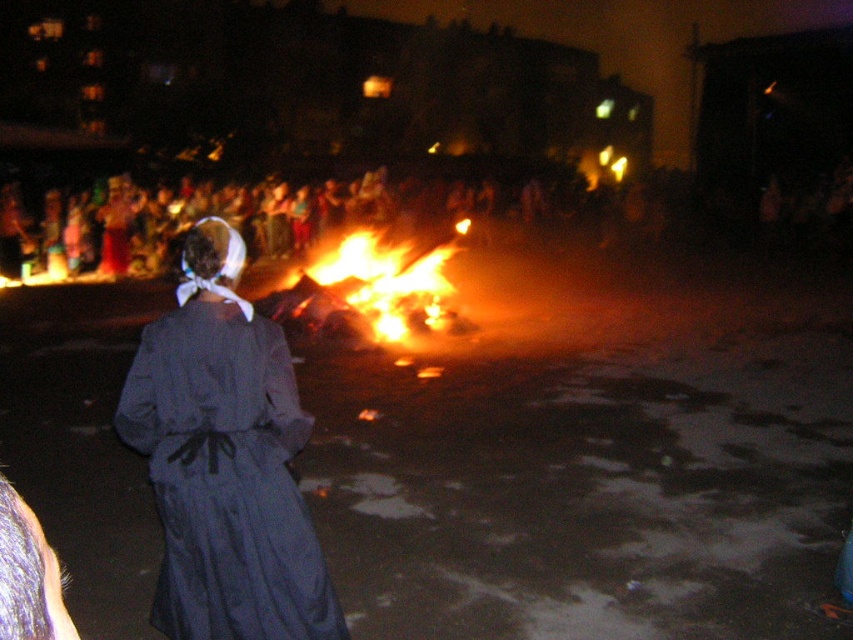
Question: Which point is farther to the camera?

Choices:
 (A) flaming wood at center
 (B) dark gray fabric dress at center

Answer: (A)

Question: Is the position of dark gray fabric dress at center less distant than that of flaming wood at center?

Choices:
 (A) no
 (B) yes

Answer: (B)

Question: Is dark gray fabric dress at center below flaming wood at center?

Choices:
 (A) no
 (B) yes

Answer: (B)

Question: Which point is closer to the camera?

Choices:
 (A) (341, 323)
 (B) (264, 588)

Answer: (B)

Question: Can you confirm if dark gray fabric dress at center is wider than flaming wood at center?

Choices:
 (A) no
 (B) yes

Answer: (B)